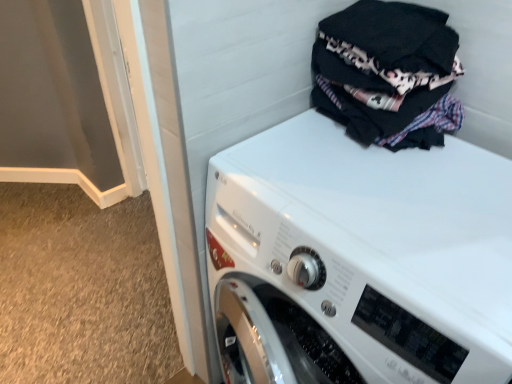
Question: From the image's perspective, is white glossy washing machine at upper right positioned above or below black cotton laundry at upper right?

Choices:
 (A) above
 (B) below

Answer: (B)

Question: Visually, is white glossy washing machine at upper right positioned to the left or to the right of black cotton laundry at upper right?

Choices:
 (A) right
 (B) left

Answer: (B)

Question: Considering the positions of white glossy washing machine at upper right and black cotton laundry at upper right in the image, is white glossy washing machine at upper right wider or thinner than black cotton laundry at upper right?

Choices:
 (A) thin
 (B) wide

Answer: (B)

Question: Relative to white glossy washing machine at upper right, is black cotton laundry at upper right in front or behind?

Choices:
 (A) front
 (B) behind

Answer: (B)

Question: From a real-world perspective, is black cotton laundry at upper right positioned above or below white glossy washing machine at upper right?

Choices:
 (A) below
 (B) above

Answer: (B)

Question: Visually, is black cotton laundry at upper right positioned to the left or to the right of white glossy washing machine at upper right?

Choices:
 (A) right
 (B) left

Answer: (A)

Question: From the image's perspective, is black cotton laundry at upper right positioned above or below white glossy washing machine at upper right?

Choices:
 (A) below
 (B) above

Answer: (B)